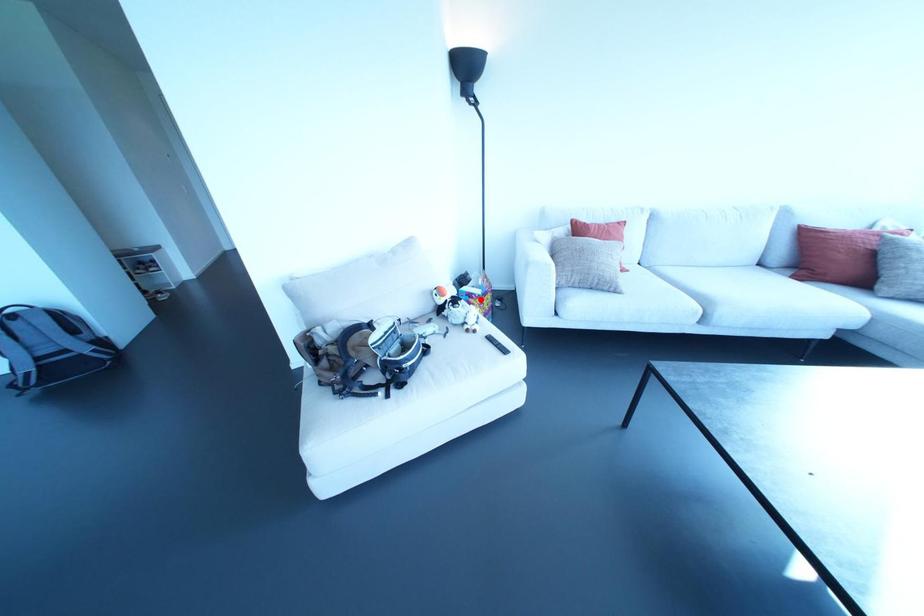
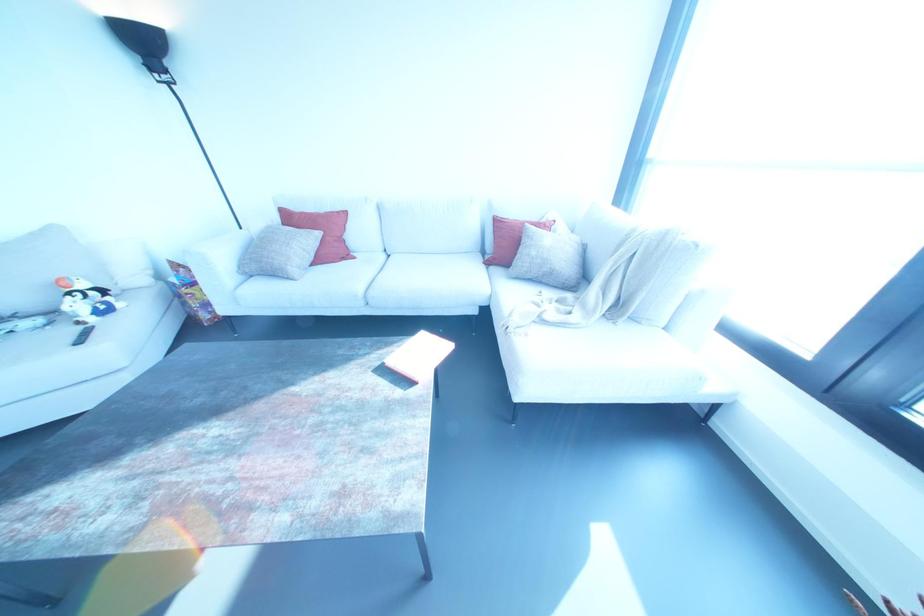
Where in the second image is the point corresponding to the highlighted location from the first image?

(184, 290)